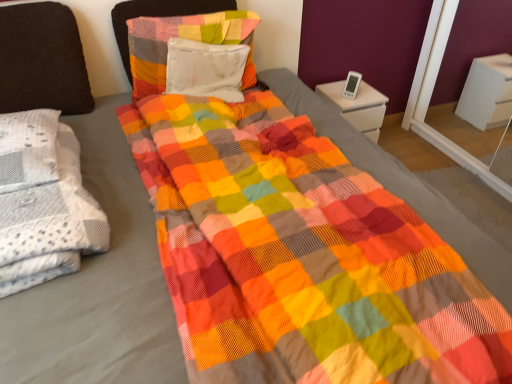
Locate an element on the screen. free spot above white glossy nightstand at upper right (from a real-world perspective) is located at coordinates (353, 91).